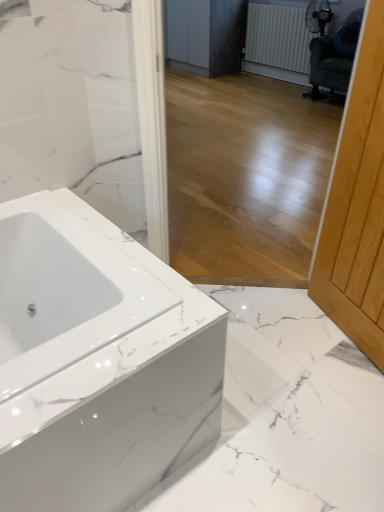
Question: Is point (375, 151) closer or farther from the camera than point (326, 71)?

Choices:
 (A) closer
 (B) farther

Answer: (A)

Question: In terms of height, does light wood screen door at right look taller or shorter compared to dark green fabric swivel chair at upper right?

Choices:
 (A) short
 (B) tall

Answer: (B)

Question: Considering the real-world distances, which object is closest to the white textured radiator at upper right?

Choices:
 (A) light wood screen door at right
 (B) dark green fabric swivel chair at upper right
 (C) white glossy bathtub at lower left
 (D) matte gray cabinetry at center

Answer: (D)

Question: Estimate the real-world distances between objects in this image. Which object is closer to the white textured radiator at upper right?

Choices:
 (A) dark green fabric swivel chair at upper right
 (B) light wood screen door at right
 (C) matte gray cabinetry at center
 (D) white glossy bathtub at lower left

Answer: (C)